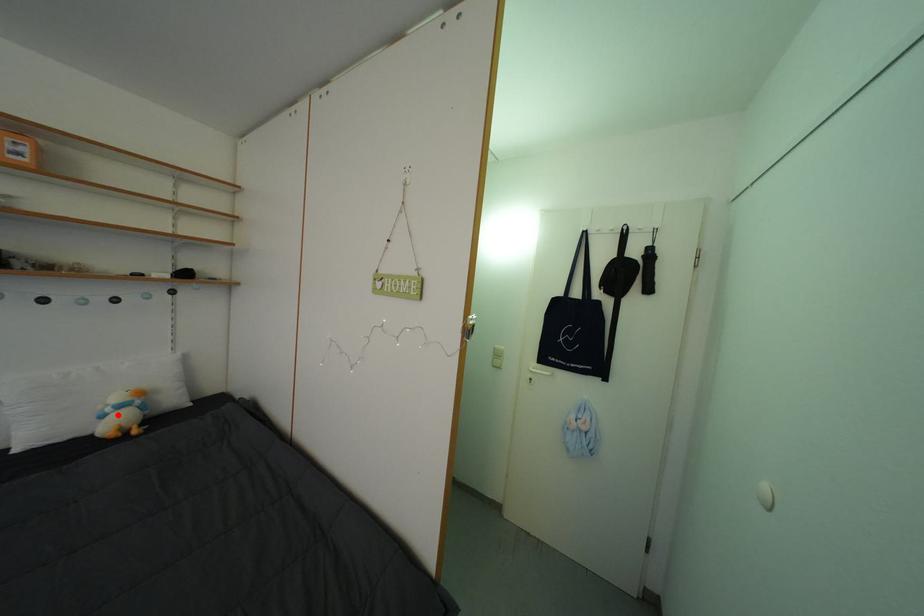
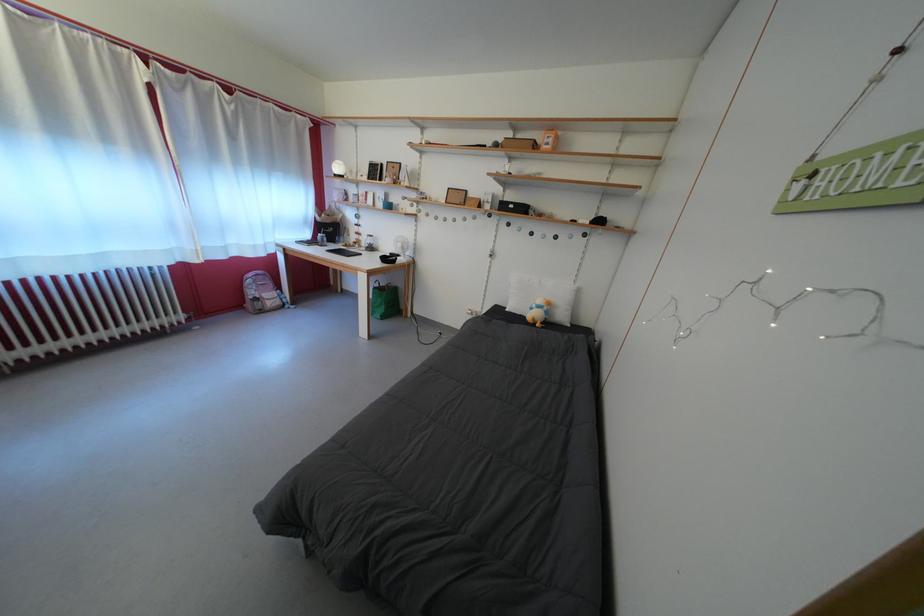
Find the pixel in the second image that matches the highlighted location in the first image.

(542, 312)